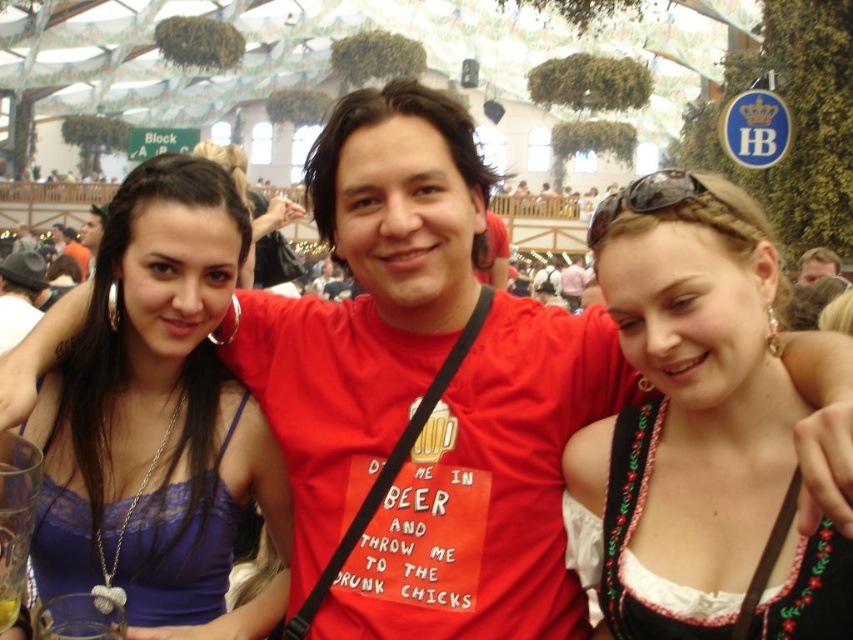
Does matte black sunglasses at upper center appear under matte black hair at upper left?

Yes.

Which is in front, point (688, 184) or point (86, 262)?

Point (688, 184) is in front.

The height and width of the screenshot is (640, 853). I want to click on matte black sunglasses at upper center, so [643, 198].

Is matte black hair at center below matte black sunglasses at upper center?

No, matte black hair at center is not below matte black sunglasses at upper center.

Which of these two, matte black hair at center or matte black sunglasses at upper center, stands shorter?

Standing shorter between the two is matte black sunglasses at upper center.

Identify the location of matte black hair at center. (258, 220).

Is white embroidered dirndl at center wider than matte black sunglasses at upper center?

Indeed, white embroidered dirndl at center has a greater width compared to matte black sunglasses at upper center.

Between white embroidered dirndl at center and matte black sunglasses at upper center, which one is positioned lower?

Positioned lower is white embroidered dirndl at center.

Is point (726, 307) positioned after point (683, 170)?

No, it is in front of (683, 170).

You are a GUI agent. You are given a task and a screenshot of the screen. Output one action in this format:
    pyautogui.click(x=<x>, y=<y>)
    Task: Click on the white embroidered dirndl at center
    The height and width of the screenshot is (640, 853).
    Given the screenshot: What is the action you would take?
    pyautogui.click(x=698, y=433)